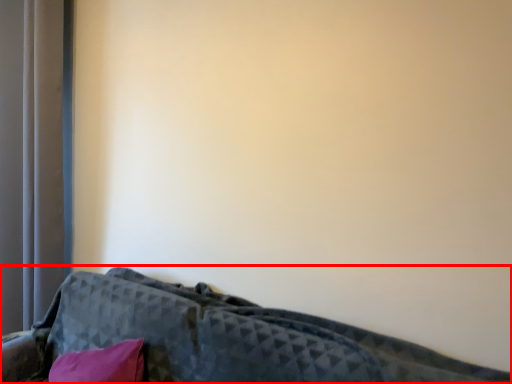
Question: Where is furniture (annotated by the red box) located in relation to curtain in the image?

Choices:
 (A) left
 (B) right

Answer: (B)